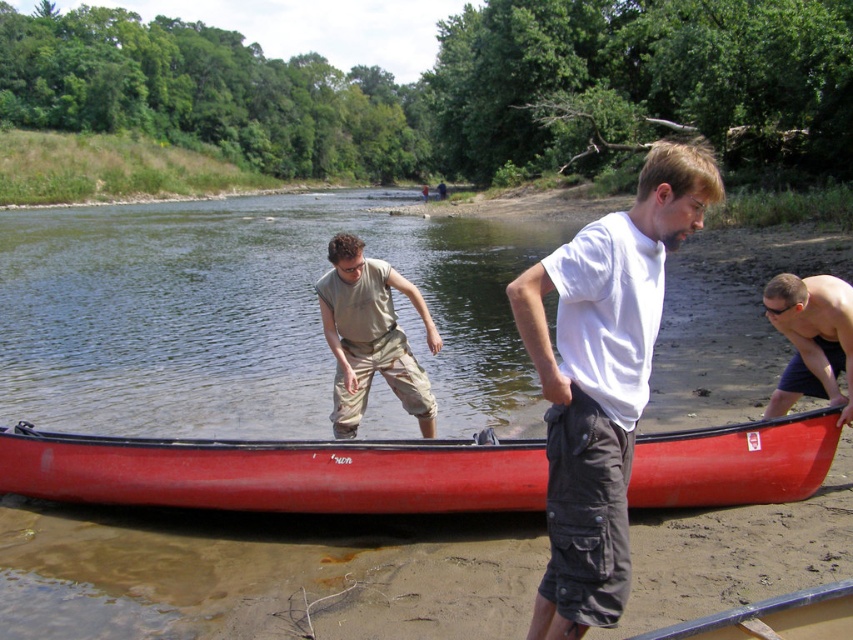
Is white cotton shirt at center smaller than khaki cotton pants at center?

No, white cotton shirt at center is not smaller than khaki cotton pants at center.

Does white cotton shirt at center have a larger size compared to khaki cotton pants at center?

Yes, white cotton shirt at center is bigger than khaki cotton pants at center.

What do you see at coordinates (602, 378) in the screenshot? Image resolution: width=853 pixels, height=640 pixels. I see `white cotton shirt at center` at bounding box center [602, 378].

You are a GUI agent. You are given a task and a screenshot of the screen. Output one action in this format:
    pyautogui.click(x=<x>, y=<y>)
    Task: Click on the white cotton shirt at center
    The width and height of the screenshot is (853, 640).
    Given the screenshot: What is the action you would take?
    pyautogui.click(x=602, y=378)

Does khaki cotton pants at center appear over shiny black skin at lower right?

Actually, khaki cotton pants at center is below shiny black skin at lower right.

I want to click on khaki cotton pants at center, so click(370, 337).

Identify the location of khaki cotton pants at center. (370, 337).

Who is taller, shiny red canoe at center or shiny black skin at lower right?

With more height is shiny black skin at lower right.

Does shiny red canoe at center appear on the right side of shiny black skin at lower right?

In fact, shiny red canoe at center is to the left of shiny black skin at lower right.

Does point (38, 496) come closer to viewer compared to point (830, 291)?

That is False.

This screenshot has height=640, width=853. Find the location of `shiny red canoe at center`. shiny red canoe at center is located at coordinates 276,472.